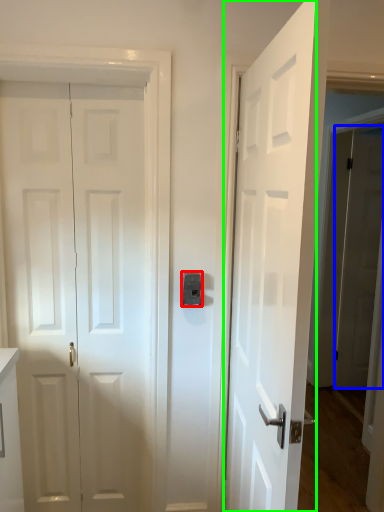
Question: Which object is the closest to the latch (highlighted by a red box)? Choose among these: door (highlighted by a blue box) or door (highlighted by a green box).

Choices:
 (A) door
 (B) door

Answer: (B)